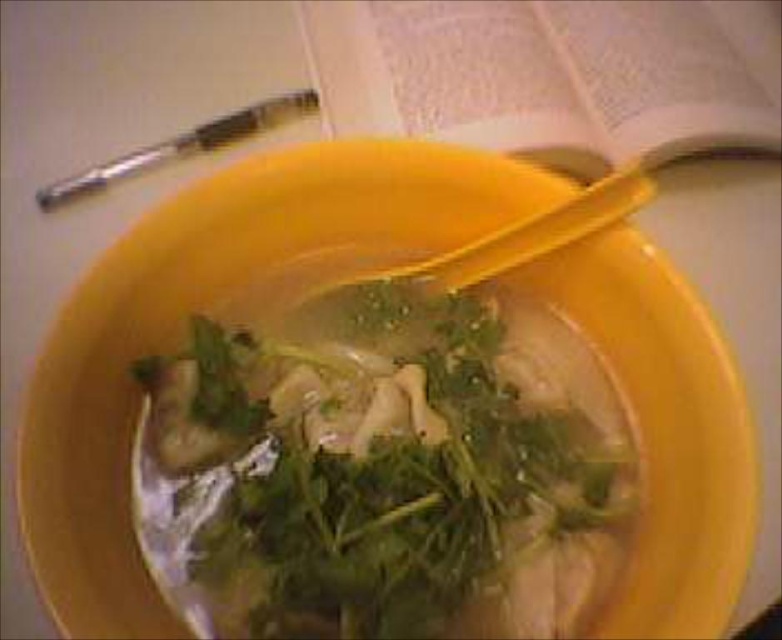
Who is higher up, green leafy vegetable at center or white paper book at upper center?

white paper book at upper center

Who is taller, green leafy vegetable at center or white paper book at upper center?

green leafy vegetable at center

Is point (492, 625) farther from viewer compared to point (687, 54)?

That is False.

Where is `green leafy vegetable at center`? This screenshot has height=640, width=782. green leafy vegetable at center is located at coordinates (382, 470).

Who is positioned more to the right, green leafy vegetable at center or metallic pen at upper left?

green leafy vegetable at center is more to the right.

What do you see at coordinates (382, 470) in the screenshot? I see `green leafy vegetable at center` at bounding box center [382, 470].

Where is `green leafy vegetable at center`? This screenshot has width=782, height=640. green leafy vegetable at center is located at coordinates (382, 470).

Which is more to the left, white paper book at upper center or metallic pen at upper left?

metallic pen at upper left

Between white paper book at upper center and metallic pen at upper left, which one is positioned lower?

metallic pen at upper left is lower down.

Who is more forward, (683, 19) or (307, 90)?

Point (307, 90)

Where is `white paper book at upper center`? This screenshot has width=782, height=640. white paper book at upper center is located at coordinates (551, 72).